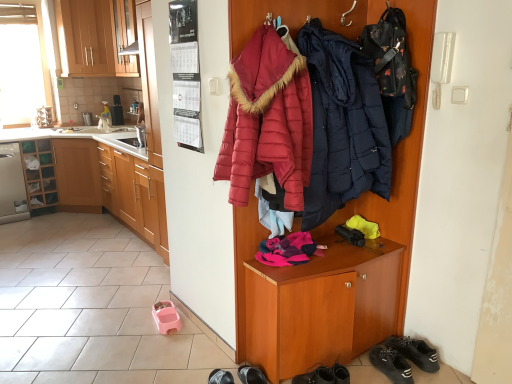
Question: From the image's perspective, is matte wood cabinets at upper left, placed as the second cabinetry when sorted from right to left, located above black suede sneakers at lower right, the 2th footwear when ordered from left to right?

Choices:
 (A) yes
 (B) no

Answer: (A)

Question: Is matte wood cabinets at upper left, placed as the second cabinetry when sorted from right to left, at the right side of black suede sneakers at lower right, the 2th footwear when ordered from left to right?

Choices:
 (A) yes
 (B) no

Answer: (B)

Question: Is matte wood cabinets at upper left, placed as the second cabinetry when sorted from right to left, in front of black suede sneakers at lower right, which is the first footwear in right-to-left order?

Choices:
 (A) no
 (B) yes

Answer: (A)

Question: Is matte wood cabinets at upper left, placed as the second cabinetry when sorted from right to left, outside black suede sneakers at lower right, the 2th footwear when ordered from left to right?

Choices:
 (A) no
 (B) yes

Answer: (B)

Question: From a real-world perspective, is matte wood cabinets at upper left, placed as the second cabinetry when sorted from right to left, under black suede sneakers at lower right, the 2th footwear when ordered from left to right?

Choices:
 (A) yes
 (B) no

Answer: (B)

Question: Is dark blue quilted jacket at center, arranged as the first jacket when viewed from the right, in front of or behind metallic stainless steel toaster at left in the image?

Choices:
 (A) behind
 (B) front

Answer: (B)

Question: Is dark blue quilted jacket at center, the second jacket viewed from the left, inside or outside of metallic stainless steel toaster at left?

Choices:
 (A) outside
 (B) inside

Answer: (A)

Question: From a real-world perspective, relative to metallic stainless steel toaster at left, is dark blue quilted jacket at center, arranged as the first jacket when viewed from the right, vertically above or below?

Choices:
 (A) above
 (B) below

Answer: (A)

Question: From the image's perspective, is dark blue quilted jacket at center, arranged as the first jacket when viewed from the right, above or below metallic stainless steel toaster at left?

Choices:
 (A) above
 (B) below

Answer: (B)

Question: Relative to wooden cabinet at right, is wooden cabinet at left, which ranks as the first cabinetry in right-to-left order, in front or behind?

Choices:
 (A) behind
 (B) front

Answer: (A)

Question: From a real-world perspective, is wooden cabinet at left, which ranks as the first cabinetry in right-to-left order, positioned above or below wooden cabinet at right?

Choices:
 (A) below
 (B) above

Answer: (A)

Question: From the image's perspective, is wooden cabinet at left, which ranks as the first cabinetry in right-to-left order, above or below wooden cabinet at right?

Choices:
 (A) above
 (B) below

Answer: (A)

Question: In terms of height, does wooden cabinet at left, acting as the third cabinetry starting from the top, look taller or shorter compared to wooden cabinet at right?

Choices:
 (A) tall
 (B) short

Answer: (B)

Question: From a real-world perspective, is metallic stainless steel toaster at left positioned above or below wooden cabinet at right?

Choices:
 (A) below
 (B) above

Answer: (B)

Question: Is metallic stainless steel toaster at left in front of or behind wooden cabinet at right in the image?

Choices:
 (A) front
 (B) behind

Answer: (B)